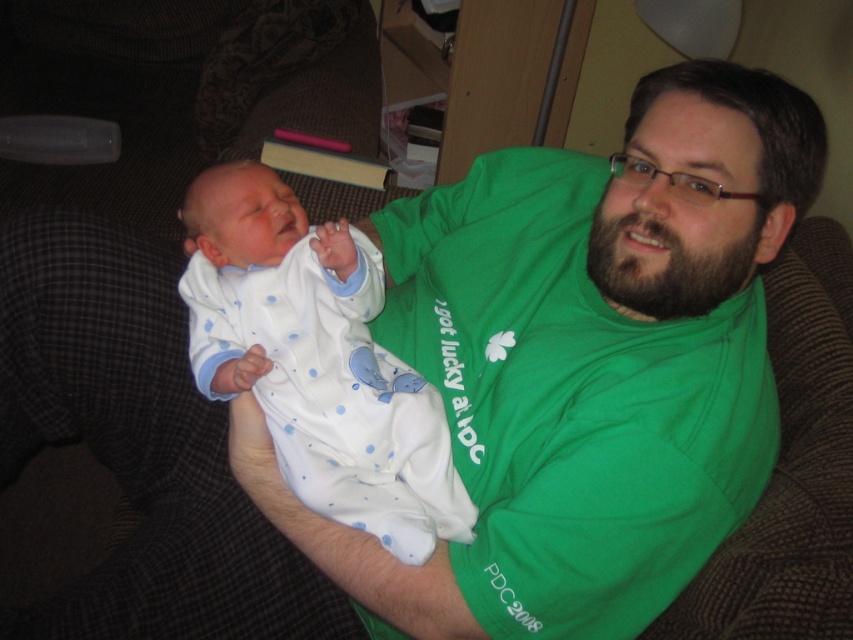
Question: Can you confirm if green cotton shirt at center is wider than white soft fabric newborn at center?

Choices:
 (A) no
 (B) yes

Answer: (B)

Question: Observing the image, what is the correct spatial positioning of green cotton shirt at center in reference to white soft fabric newborn at center?

Choices:
 (A) below
 (B) above

Answer: (B)

Question: Which of the following is the farthest from the observer?

Choices:
 (A) (473, 262)
 (B) (311, 406)

Answer: (A)

Question: Does green cotton shirt at center have a larger size compared to white soft fabric newborn at center?

Choices:
 (A) yes
 (B) no

Answer: (A)